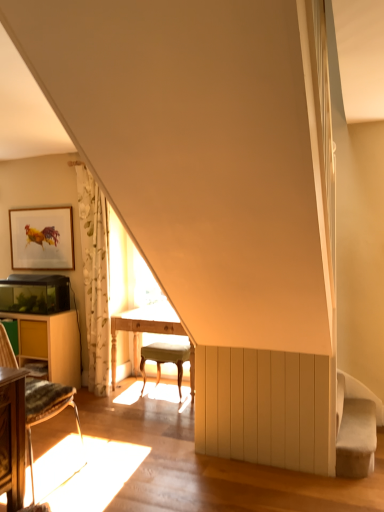
Question: Is wooden table at left, marked as the 2th table in a right-to-left arrangement, located within light beige fabric stool at center?

Choices:
 (A) no
 (B) yes

Answer: (A)

Question: Considering the relative sizes of light beige fabric stool at center and wooden table at left, marked as the 2th table in a right-to-left arrangement, in the image provided, is light beige fabric stool at center taller than wooden table at left, marked as the 2th table in a right-to-left arrangement,?

Choices:
 (A) no
 (B) yes

Answer: (A)

Question: Is light beige fabric stool at center bigger than wooden table at left, marked as the 2th table in a right-to-left arrangement?

Choices:
 (A) no
 (B) yes

Answer: (A)

Question: Is wooden table at left, the 1th table when ordered from left to right, at the back of light beige fabric stool at center?

Choices:
 (A) yes
 (B) no

Answer: (B)

Question: From a real-world perspective, is light beige fabric stool at center physically above wooden table at left, marked as the 2th table in a right-to-left arrangement?

Choices:
 (A) no
 (B) yes

Answer: (A)

Question: From a real-world perspective, is light beige fabric stool at center physically below wooden table at left, the 1th table when ordered from left to right?

Choices:
 (A) yes
 (B) no

Answer: (A)

Question: Is wooden chair at lower left closer to the viewer compared to gold-framed artwork at upper left?

Choices:
 (A) yes
 (B) no

Answer: (A)

Question: Can you confirm if wooden chair at lower left is taller than gold-framed artwork at upper left?

Choices:
 (A) no
 (B) yes

Answer: (B)

Question: From a real-world perspective, is wooden chair at lower left on top of gold-framed artwork at upper left?

Choices:
 (A) yes
 (B) no

Answer: (B)

Question: From the image's perspective, is wooden chair at lower left above gold-framed artwork at upper left?

Choices:
 (A) no
 (B) yes

Answer: (A)

Question: Can you confirm if wooden chair at lower left is bigger than gold-framed artwork at upper left?

Choices:
 (A) yes
 (B) no

Answer: (A)

Question: Is wooden chair at lower left outside of gold-framed artwork at upper left?

Choices:
 (A) no
 (B) yes

Answer: (B)

Question: Is light wood table at center, which is counted as the first table, starting from the right, at the back of wooden chair at lower left?

Choices:
 (A) yes
 (B) no

Answer: (B)